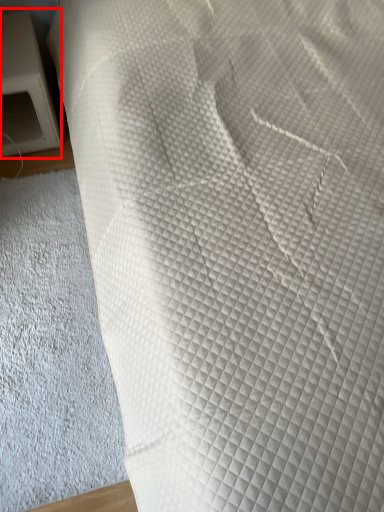
Question: From the image's perspective, where is furniture (annotated by the red box) located in relation to sheet in the image?

Choices:
 (A) above
 (B) below

Answer: (A)